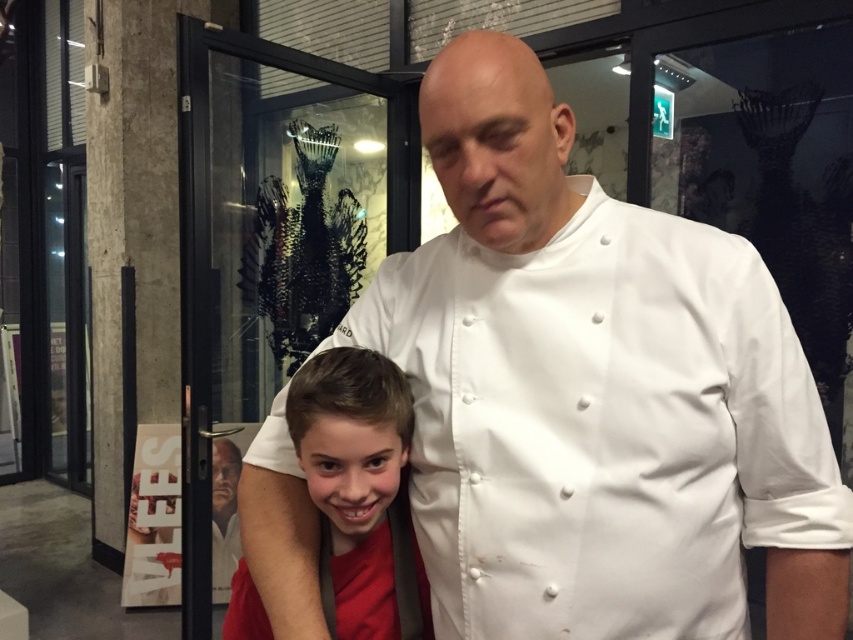
Between point (518, 454) and point (409, 388), which one is positioned behind?

Positioned behind is point (409, 388).

Between point (663, 612) and point (347, 461), which one is positioned in front?

Point (347, 461) is in front.

Is point (746, 275) closer to camera compared to point (335, 438)?

No, (746, 275) is further to viewer.

Image resolution: width=853 pixels, height=640 pixels. What are the coordinates of `white matte chef coat at center` in the screenshot? It's located at (595, 392).